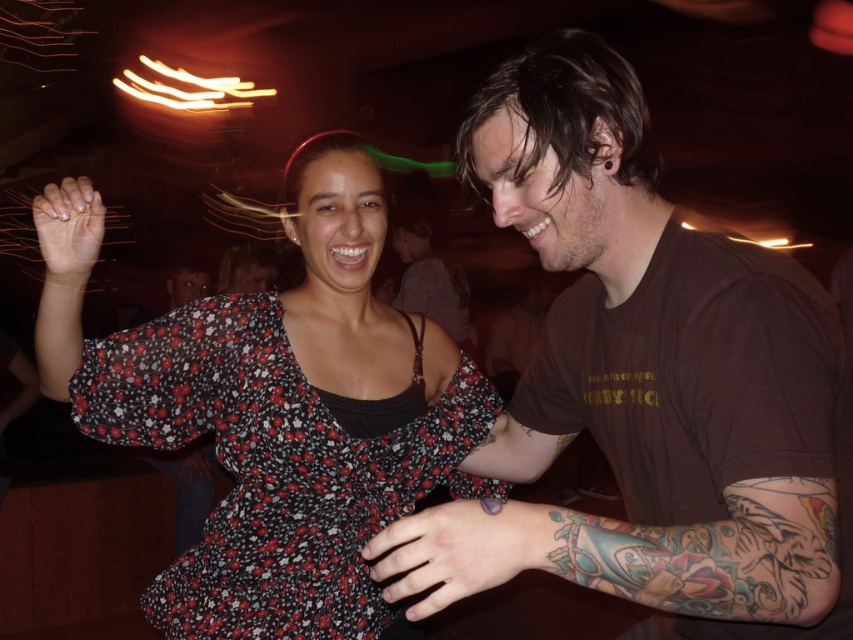
Question: Does brown cotton t-shirt at right have a greater width compared to floral-patterned fabric dress at center?

Choices:
 (A) yes
 (B) no

Answer: (B)

Question: Does brown cotton t-shirt at right come behind floral-patterned fabric dress at center?

Choices:
 (A) yes
 (B) no

Answer: (B)

Question: Which object is closer to the camera taking this photo?

Choices:
 (A) brown cotton t-shirt at right
 (B) floral-patterned fabric dress at center

Answer: (A)

Question: Among these objects, which one is nearest to the camera?

Choices:
 (A) floral-patterned fabric dress at center
 (B) brown cotton t-shirt at right

Answer: (B)

Question: Is brown cotton t-shirt at right in front of floral-patterned fabric dress at center?

Choices:
 (A) yes
 (B) no

Answer: (A)